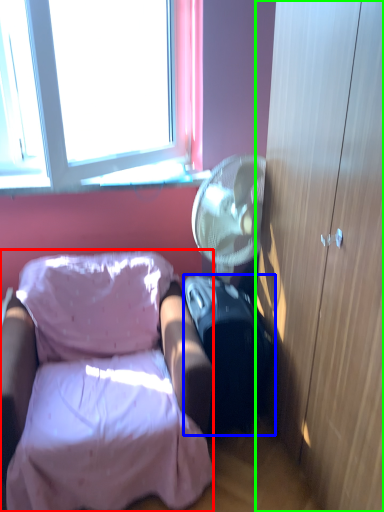
Question: Estimate the real-world distances between objects in this image. Which object is closer to chair (highlighted by a red box), suitcase (highlighted by a blue box) or cabinetry (highlighted by a green box)?

Choices:
 (A) suitcase
 (B) cabinetry

Answer: (A)